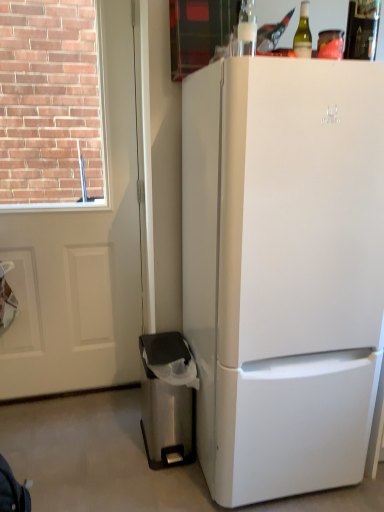
Question: Would you say stainless steel trash can at lower left is to the left or to the right of white matte screen door at left in the picture?

Choices:
 (A) left
 (B) right

Answer: (B)

Question: Would you say stainless steel trash can at lower left is inside or outside white matte screen door at left?

Choices:
 (A) inside
 (B) outside

Answer: (B)

Question: Which is nearer to the white matte screen door at left?

Choices:
 (A) white matte refrigerator at right
 (B) green glass bottle at upper right, arranged as the 1th bottle when viewed from the right
 (C) green glass bottle at upper center, which ranks as the second bottle in right-to-left order
 (D) stainless steel trash can at lower left

Answer: (D)

Question: Which object is the closest to the green glass bottle at upper right, which is the 2th bottle from left to right?

Choices:
 (A) white matte screen door at left
 (B) stainless steel trash can at lower left
 (C) green glass bottle at upper center, arranged as the 1th bottle when viewed from the left
 (D) white matte refrigerator at right

Answer: (C)